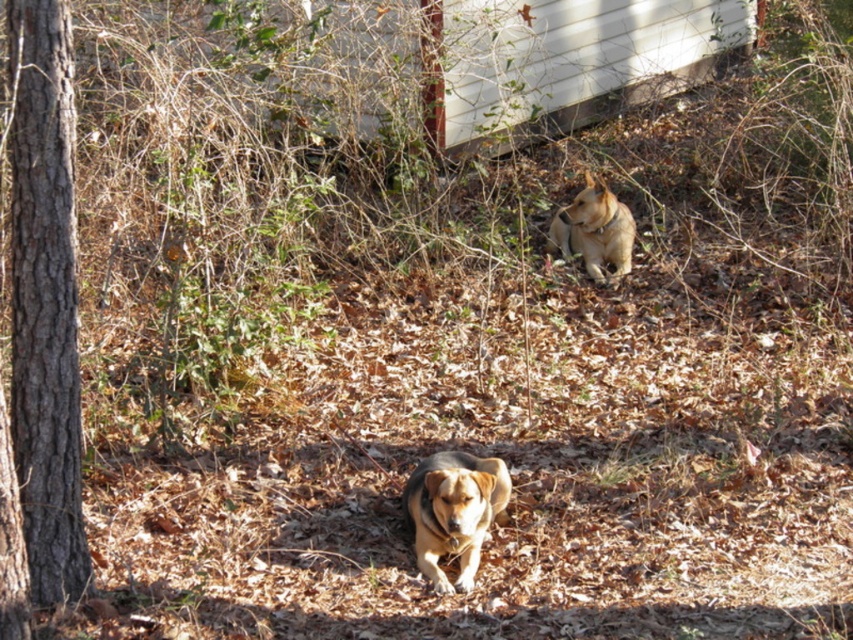
Image resolution: width=853 pixels, height=640 pixels. Describe the element at coordinates (453, 512) in the screenshot. I see `brown fur dog at center` at that location.

Which is in front, point (447, 506) or point (585, 216)?

Point (447, 506)

In order to click on brown fur dog at center in this screenshot , I will do `click(453, 512)`.

Can you confirm if brown rough bark tree at left is positioned to the left of brown fur dog at upper center?

Indeed, brown rough bark tree at left is positioned on the left side of brown fur dog at upper center.

Does brown rough bark tree at left appear on the right side of brown fur dog at upper center?

No, brown rough bark tree at left is not to the right of brown fur dog at upper center.

Is point (42, 244) behind point (633, 227)?

No, it is not.

Where is `brown rough bark tree at left`? The image size is (853, 640). brown rough bark tree at left is located at coordinates pos(45,301).

Which is below, brown rough bark tree at left or brown fur dog at center?

brown fur dog at center is below.

Locate an element on the screen. brown rough bark tree at left is located at coordinates (45, 301).

Which is behind, point (65, 72) or point (448, 518)?

The point (448, 518) is more distant.

I want to click on brown rough bark tree at left, so click(x=45, y=301).